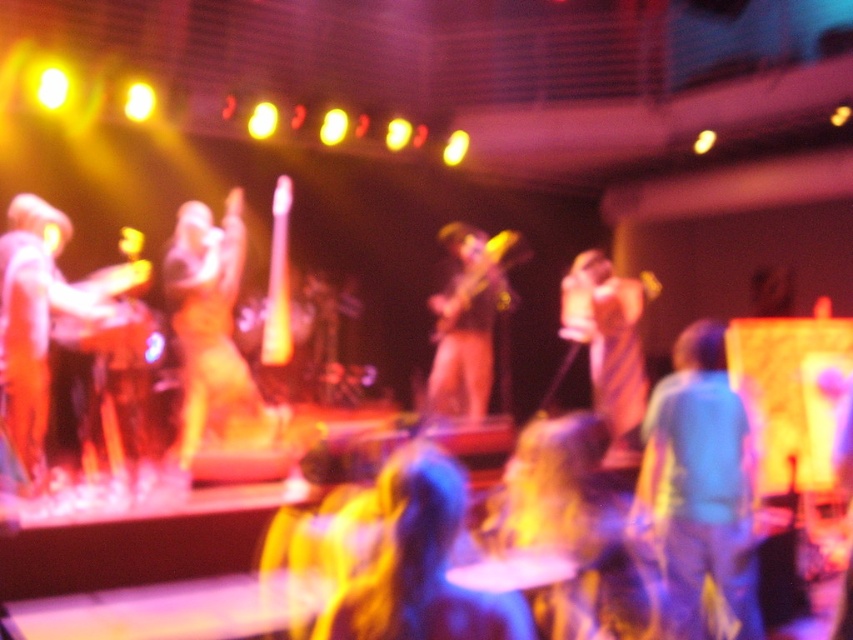
Question: Can you confirm if shiny blue hair at center is positioned to the right of matte gold guitar at left?

Choices:
 (A) no
 (B) yes

Answer: (B)

Question: Does shiny blue hair at center appear on the right side of striped fabric dress at center?

Choices:
 (A) yes
 (B) no

Answer: (B)

Question: Which object is the closest to the matte gold guitar at left?

Choices:
 (A) shiny blue hair at center
 (B) blue fabric shirt at center
 (C) striped fabric dress at center

Answer: (B)

Question: Which point is closer to the camera taking this photo?

Choices:
 (A) (65, 300)
 (B) (740, 497)
 (C) (634, 337)
 (D) (201, 289)

Answer: (B)

Question: Is blue fabric shirt at center positioned in front of shiny gold dress at center?

Choices:
 (A) yes
 (B) no

Answer: (A)

Question: Based on their relative distances, which object is farther from the blue fabric shirt at center?

Choices:
 (A) striped fabric dress at center
 (B) matte gold guitar at left

Answer: (B)